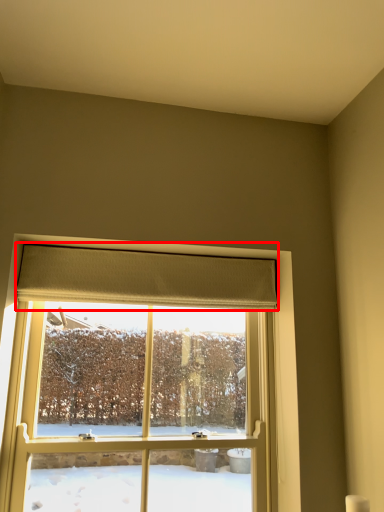
Question: Considering the relative positions of curtain (annotated by the red box) and window in the image provided, where is curtain (annotated by the red box) located with respect to the staircase?

Choices:
 (A) left
 (B) right

Answer: (B)